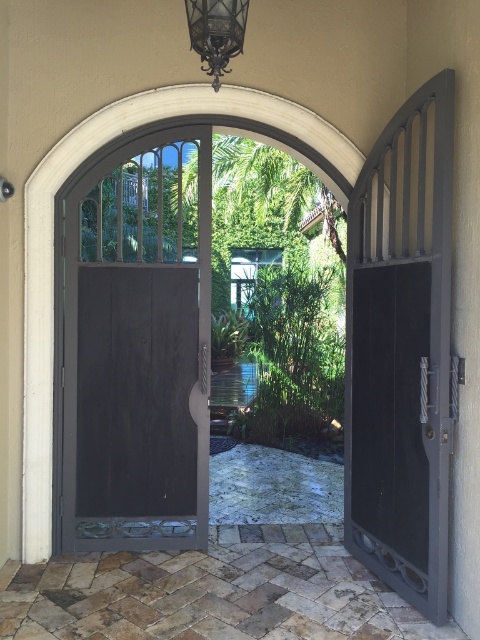
You are standing in front of the arched doorway and want to reach a specific point marked at coordinates point (98, 456). If your reach extends 1 meter forward, will you be able to touch that point?

The distance of point (98, 456) from viewer is 3.93 meters, so no, you cannot touch it with a 1 meter reach since it is much farther away.